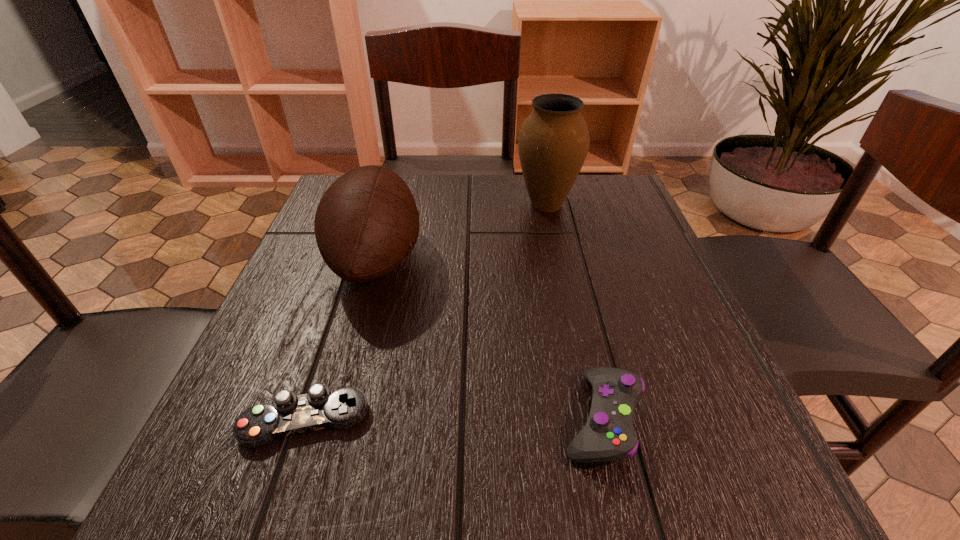
Where is `the tallest object`? the tallest object is located at coordinates (553, 142).

The image size is (960, 540). Identify the location of football. (367, 222).

Locate an element on the screen. The image size is (960, 540). the second shortest object is located at coordinates (609, 435).

At what (x,y) coordinates should I click in order to perform the action: click on the right control. Please return your answer as a coordinate pair (x, y). Image resolution: width=960 pixels, height=540 pixels. Looking at the image, I should click on (609, 435).

The width and height of the screenshot is (960, 540). Find the location of `the shortest object`. the shortest object is located at coordinates click(290, 414).

Image resolution: width=960 pixels, height=540 pixels. Find the location of `the shorter control`. the shorter control is located at coordinates (290, 414).

Where is `free space located 0.170m on the front of the urn`? The width and height of the screenshot is (960, 540). free space located 0.170m on the front of the urn is located at coordinates (561, 271).

Where is `free space located on the laces of the football`? The image size is (960, 540). free space located on the laces of the football is located at coordinates (461, 260).

The width and height of the screenshot is (960, 540). I want to click on vacant position located on the back of the taller control, so click(567, 271).

Image resolution: width=960 pixels, height=540 pixels. I want to click on free region located on the right of the shortest object, so click(557, 421).